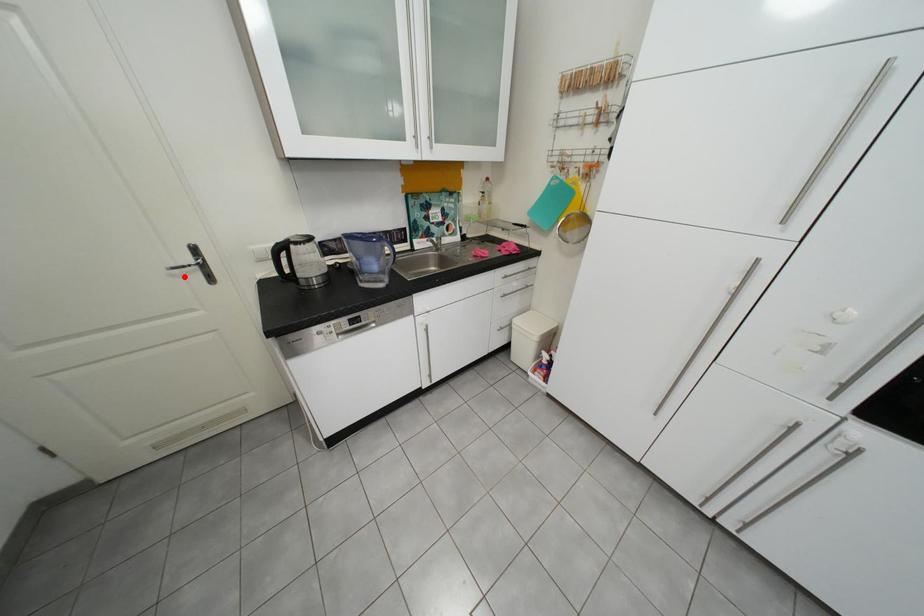
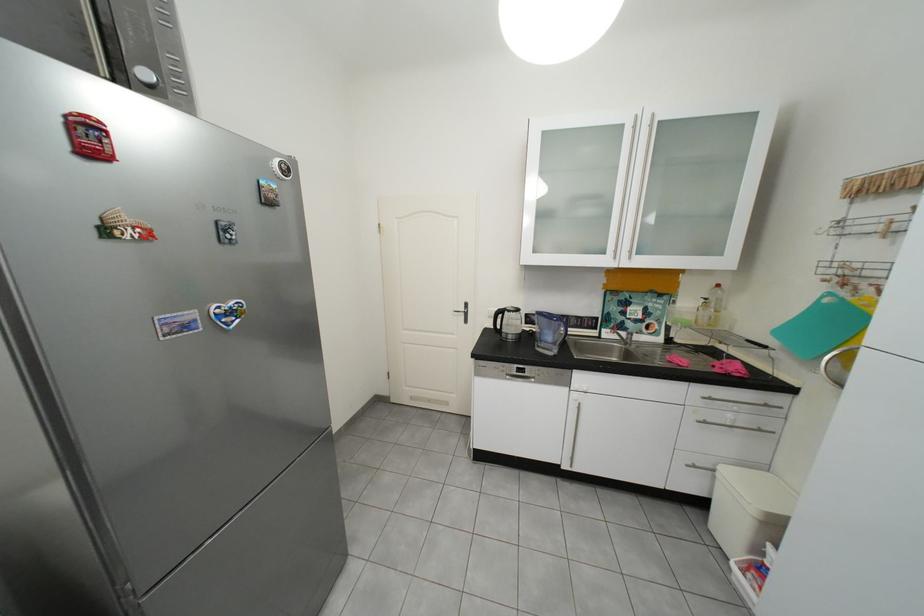
The point at the highlighted location is marked in the first image. Where is the corresponding point in the second image?

(466, 315)